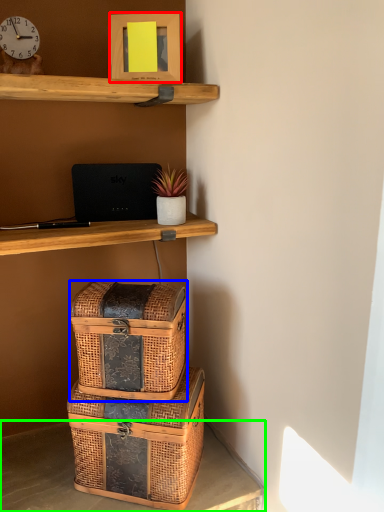
Question: Considering the real-world distances, which object is farthest from picture frame (highlighted by a red box)? box (highlighted by a blue box) or desk (highlighted by a green box)?

Choices:
 (A) box
 (B) desk

Answer: (B)